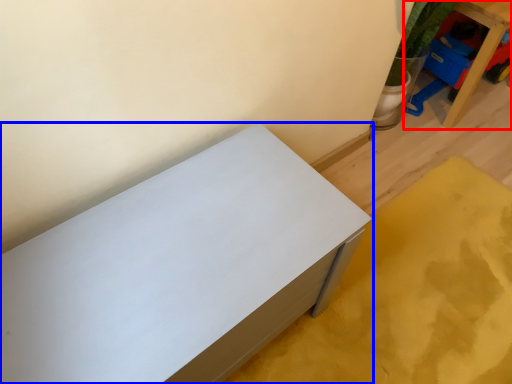
Question: Among these objects, which one is farthest to the camera, furniture (highlighted by a red box) or furniture (highlighted by a blue box)?

Choices:
 (A) furniture
 (B) furniture

Answer: (A)